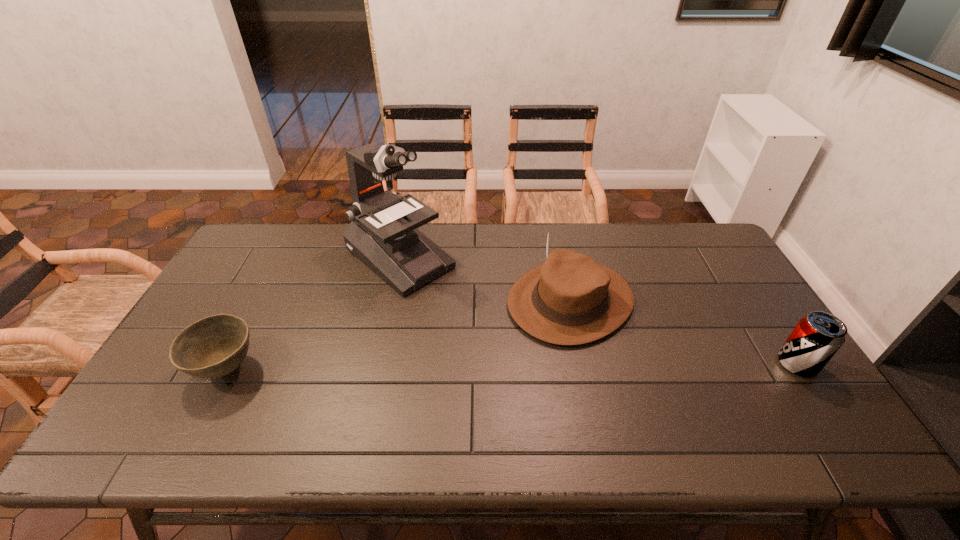
The height and width of the screenshot is (540, 960). In order to click on free spot between the shortest object and the second object from right to left in this screenshot , I will do `click(398, 335)`.

Where is `vacant area that lies between the third object from left to right and the microscope`? This screenshot has width=960, height=540. vacant area that lies between the third object from left to right and the microscope is located at coordinates (485, 279).

Identify the location of free spot between the shortest object and the third object from right to left. The width and height of the screenshot is (960, 540). (313, 313).

Where is `vacant area that lies between the third object from left to right and the tallest object`? Image resolution: width=960 pixels, height=540 pixels. vacant area that lies between the third object from left to right and the tallest object is located at coordinates [x=485, y=279].

You are a GUI agent. You are given a task and a screenshot of the screen. Output one action in this format:
    pyautogui.click(x=<x>, y=<y>)
    Task: Click on the object that can be found as the second closest to the shortest object
    The height and width of the screenshot is (540, 960).
    Given the screenshot: What is the action you would take?
    571,299

Locate an element on the screen. Image resolution: width=960 pixels, height=540 pixels. object that can be found as the closest to the soda can is located at coordinates (571, 299).

Identify the location of vacant point that satisfies the following two spatial constraints: 1. on the back side of the bowl; 2. on the right side of the soda can. (228, 364).

Find the location of a particular element. Image resolution: width=960 pixels, height=540 pixels. free point that satisfies the following two spatial constraints: 1. on the front side of the fedora; 2. on the right side of the third object from right to left is located at coordinates (391, 301).

The width and height of the screenshot is (960, 540). I want to click on vacant space that satisfies the following two spatial constraints: 1. on the front side of the fedora; 2. on the right side of the microscope, so click(x=391, y=301).

You are a GUI agent. You are given a task and a screenshot of the screen. Output one action in this format:
    pyautogui.click(x=<x>, y=<y>)
    Task: Click on the free space that satisfies the following two spatial constraints: 1. on the front side of the rightmost object; 2. on the right side of the third shortest object
    The width and height of the screenshot is (960, 540).
    Given the screenshot: What is the action you would take?
    pyautogui.click(x=584, y=364)